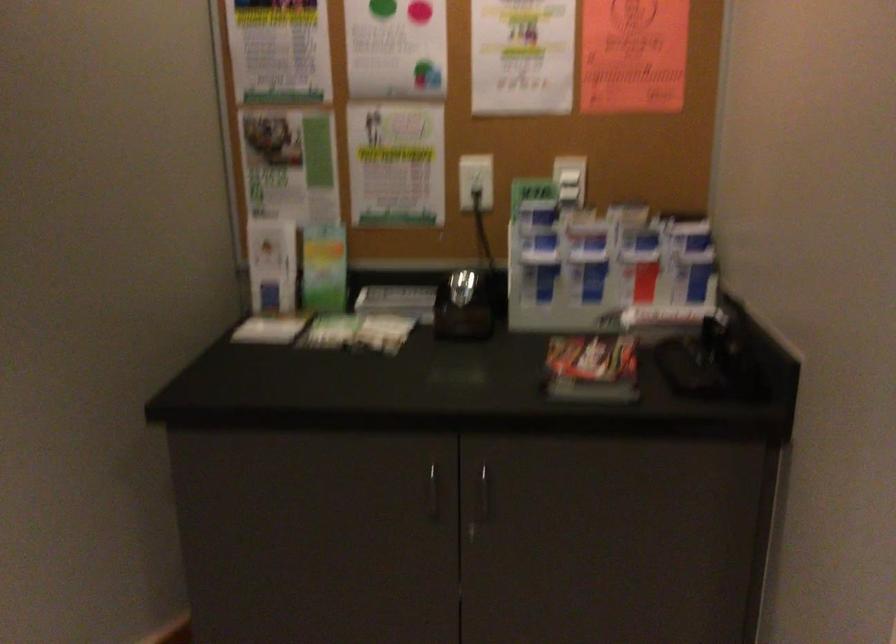
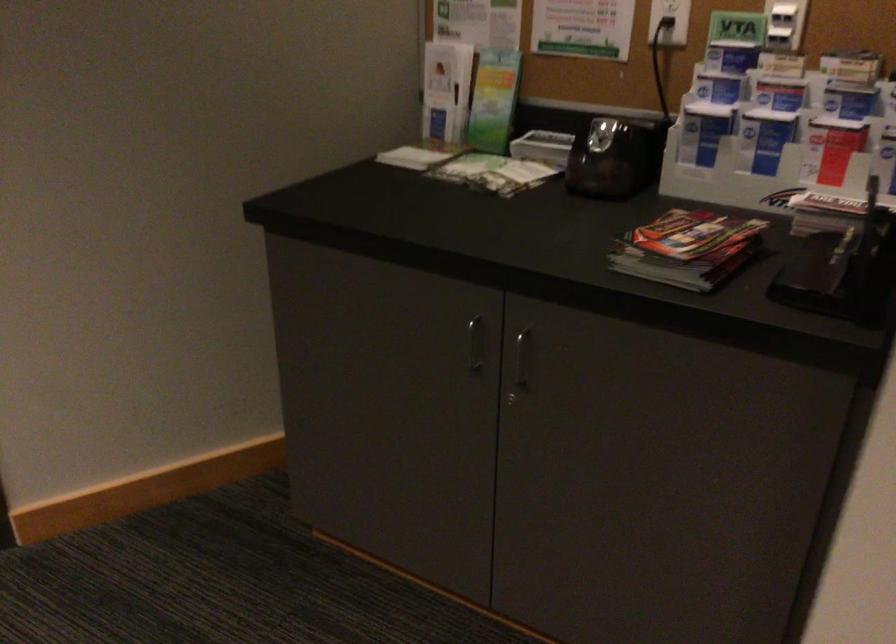
Question: The camera is either moving clockwise (left) or counter-clockwise (right) around the object. The first image is from the beginning of the video and the second image is from the end. Is the camera moving left or right when shooting the video?

Choices:
 (A) Left
 (B) Right

Answer: (B)